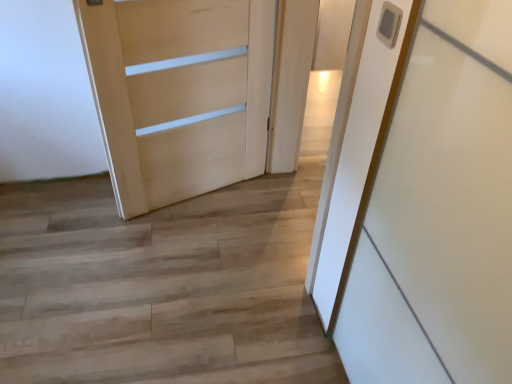
Question: Is wooden floor at center wider or thinner than white glossy door at center, the second door positioned from the left?

Choices:
 (A) thin
 (B) wide

Answer: (B)

Question: In the image, is wooden floor at center positioned in front of or behind white glossy door at center, the second door positioned from the left?

Choices:
 (A) front
 (B) behind

Answer: (A)

Question: Considering the real-world distances, which object is farthest from the light wood door at center, which is the first door in left-to-right order?

Choices:
 (A) white glossy door at center, the second door positioned from the left
 (B) wooden floor at center

Answer: (B)

Question: Estimate the real-world distances between objects in this image. Which object is closer to the wooden floor at center?

Choices:
 (A) white glossy door at center, the second door positioned from the left
 (B) light wood door at center, which is the first door in left-to-right order

Answer: (B)